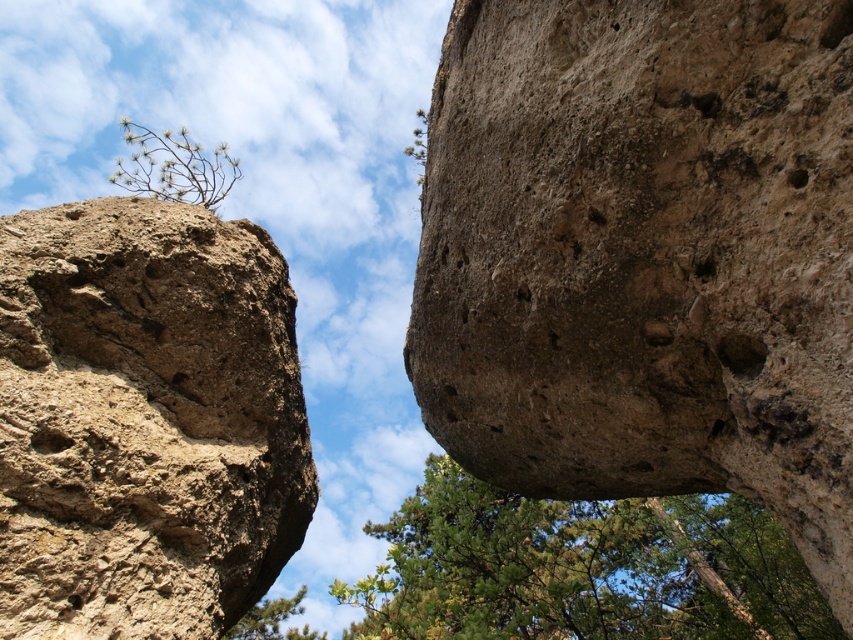
Is point (675, 234) more distant than point (199, 381)?

No, it is in front of (199, 381).

The width and height of the screenshot is (853, 640). What do you see at coordinates (645, 257) in the screenshot? I see `brown rough rock at center` at bounding box center [645, 257].

At what (x,y) coordinates should I click in order to perform the action: click on brown rough rock at center. Please return your answer as a coordinate pair (x, y). Looking at the image, I should click on click(x=645, y=257).

Is point (802, 600) positioned before point (161, 188)?

No.

Who is shorter, green leafy tree at center or green leafy tree at upper left?

Standing shorter between the two is green leafy tree at center.

This screenshot has height=640, width=853. Find the location of `green leafy tree at center`. green leafy tree at center is located at coordinates (581, 568).

Does brown rough rock at center appear over green leafy tree at upper left?

No, brown rough rock at center is not above green leafy tree at upper left.

What do you see at coordinates (645, 257) in the screenshot? Image resolution: width=853 pixels, height=640 pixels. I see `brown rough rock at center` at bounding box center [645, 257].

You are a GUI agent. You are given a task and a screenshot of the screen. Output one action in this format:
    pyautogui.click(x=<x>, y=<y>)
    Task: Click on the brown rough rock at center
    
    Given the screenshot: What is the action you would take?
    pyautogui.click(x=645, y=257)